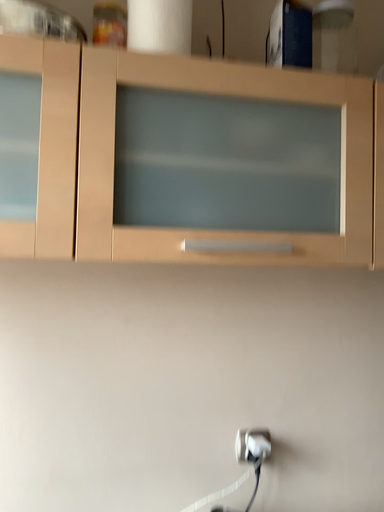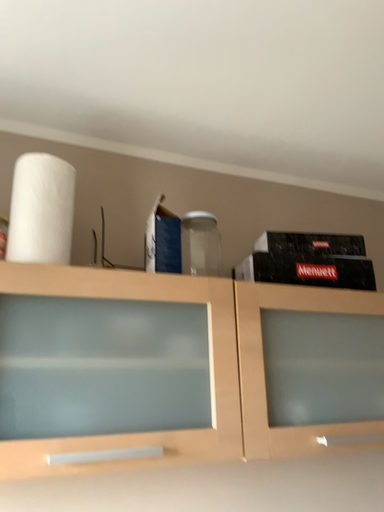
Question: How did the camera likely rotate when shooting the video?

Choices:
 (A) rotated right
 (B) rotated left

Answer: (A)